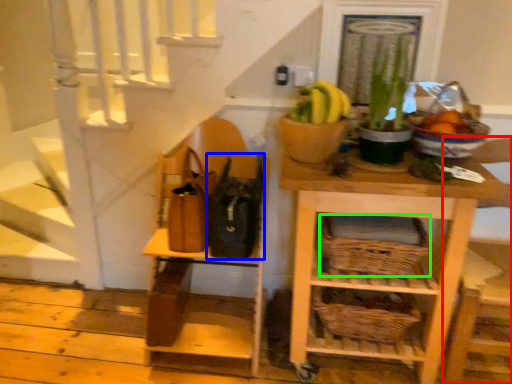
Question: Which is nearer to the chair (highlighted by a red box)? bag (highlighted by a blue box) or basket (highlighted by a green box).

Choices:
 (A) bag
 (B) basket

Answer: (B)